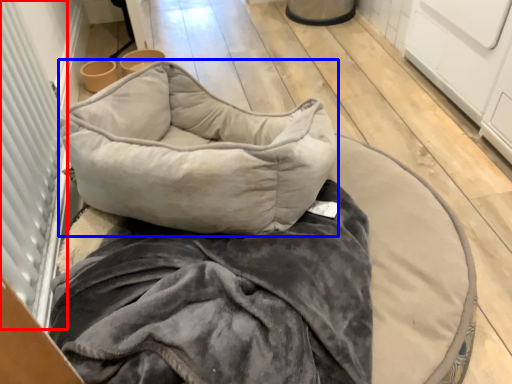
Question: Among these objects, which one is farthest to the camera, screen door (highlighted by a red box) or pillow (highlighted by a blue box)?

Choices:
 (A) screen door
 (B) pillow

Answer: (B)